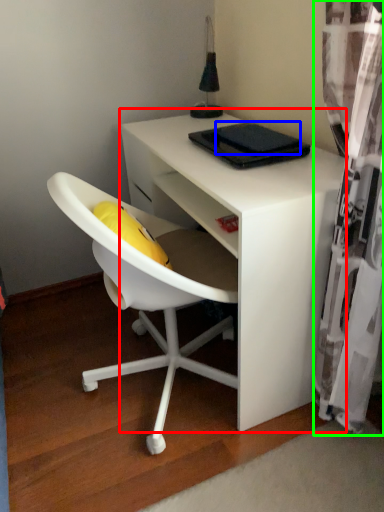
Question: Which object is positioned closest to desk (highlighted by a red box)? Select from pad (highlighted by a blue box) and curtain (highlighted by a green box).

Choices:
 (A) pad
 (B) curtain

Answer: (B)